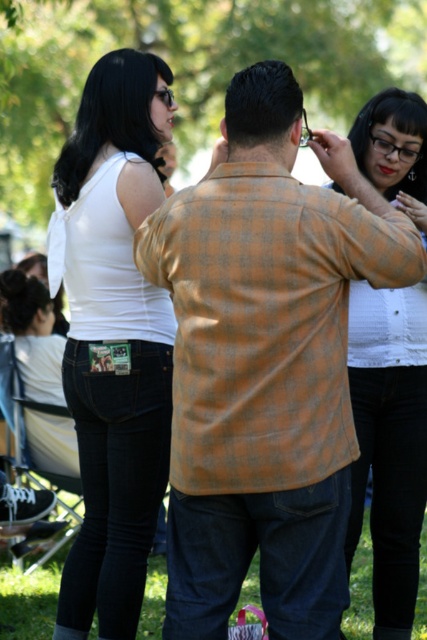
Question: Does orange checkered shirt at center appear on the right side of matte white shirt at center?

Choices:
 (A) no
 (B) yes

Answer: (A)

Question: Which of the following is the farthest from the observer?

Choices:
 (A) white matte tank top at upper left
 (B) matte white shirt at center
 (C) orange checkered shirt at center

Answer: (A)

Question: Can you confirm if orange checkered shirt at center is positioned below matte white shirt at center?

Choices:
 (A) yes
 (B) no

Answer: (B)

Question: Is white matte tank top at upper left further to the viewer compared to matte white shirt at center?

Choices:
 (A) no
 (B) yes

Answer: (B)

Question: Which point appears closest to the camera in this image?

Choices:
 (A) (359, 305)
 (B) (283, 630)

Answer: (B)

Question: Which object appears closest to the camera in this image?

Choices:
 (A) orange checkered shirt at center
 (B) white matte tank top at upper left

Answer: (A)